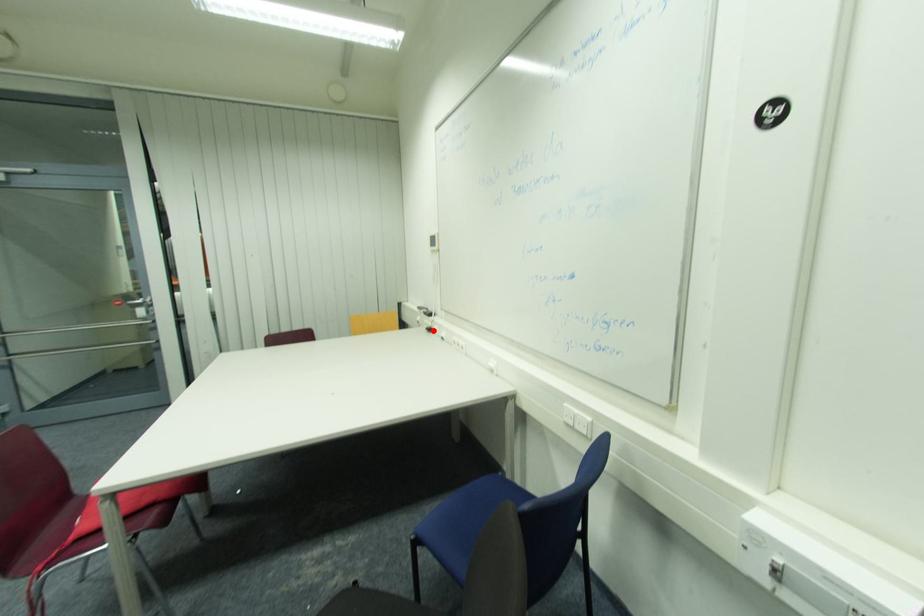
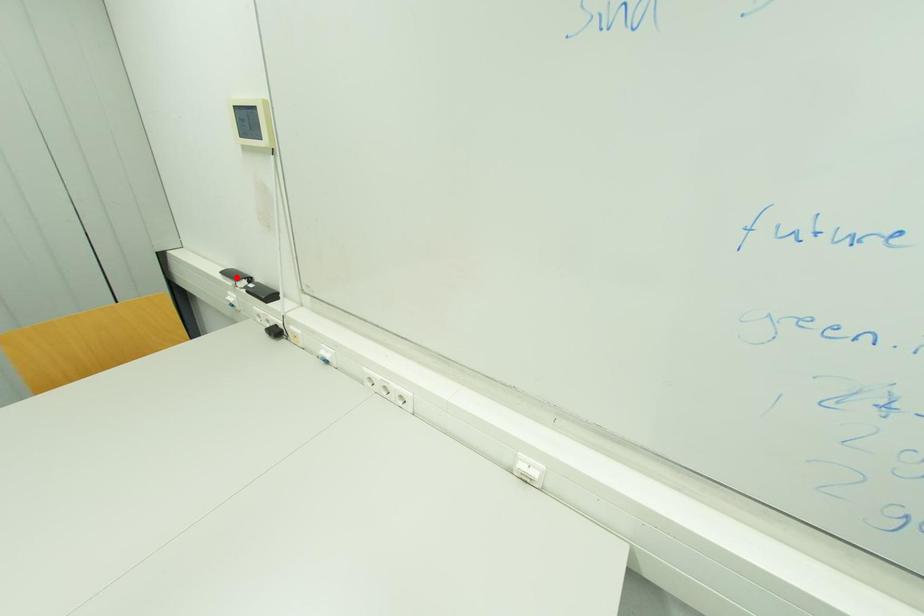
I am providing you with two images of the same scene from different viewpoints. A red point is marked on the first image and another point is marked on the second image. Is the marked point in image1 the same physical position as the marked point in image2?

No